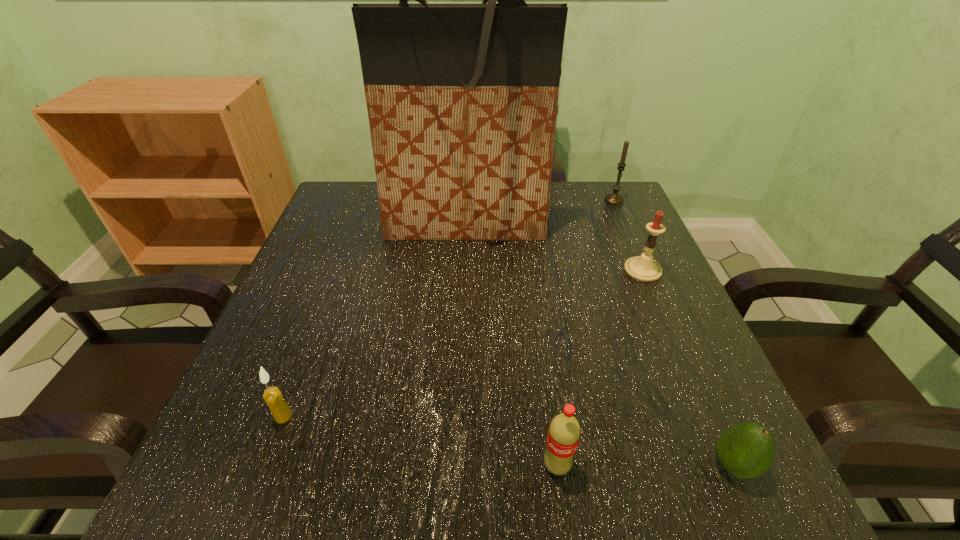
This screenshot has width=960, height=540. What are the coordinates of `the tallest object` in the screenshot? It's located at (462, 98).

This screenshot has height=540, width=960. I want to click on the farthest candle, so click(x=614, y=198).

The height and width of the screenshot is (540, 960). I want to click on the third farthest object, so click(643, 268).

You are a GUI agent. You are given a task and a screenshot of the screen. Output one action in this format:
    pyautogui.click(x=<x>, y=<y>)
    Task: Click on the soda
    The image size is (960, 540).
    Given the screenshot: What is the action you would take?
    pyautogui.click(x=564, y=431)

What are the coordinates of `the third nearest object` in the screenshot? It's located at point(273,397).

You are a GUI agent. You are given a task and a screenshot of the screen. Output one action in this format:
    pyautogui.click(x=<x>, y=<y>)
    Task: Click on the leftmost object
    The height and width of the screenshot is (540, 960).
    Given the screenshot: What is the action you would take?
    pyautogui.click(x=273, y=397)

Locate an element on the screen. avocado is located at coordinates (746, 450).

The height and width of the screenshot is (540, 960). I want to click on free region located on the front-facing side of the shopping bag, so [x=460, y=364].

This screenshot has width=960, height=540. Find the location of `vacant space positioned 0.400m on the left of the farthest candle`. vacant space positioned 0.400m on the left of the farthest candle is located at coordinates (456, 199).

At what (x,y) coordinates should I click in order to perform the action: click on free spot located 0.130m on the back of the fourth nearest object. Please return your answer as a coordinate pair (x, y). The height and width of the screenshot is (540, 960). Looking at the image, I should click on (624, 226).